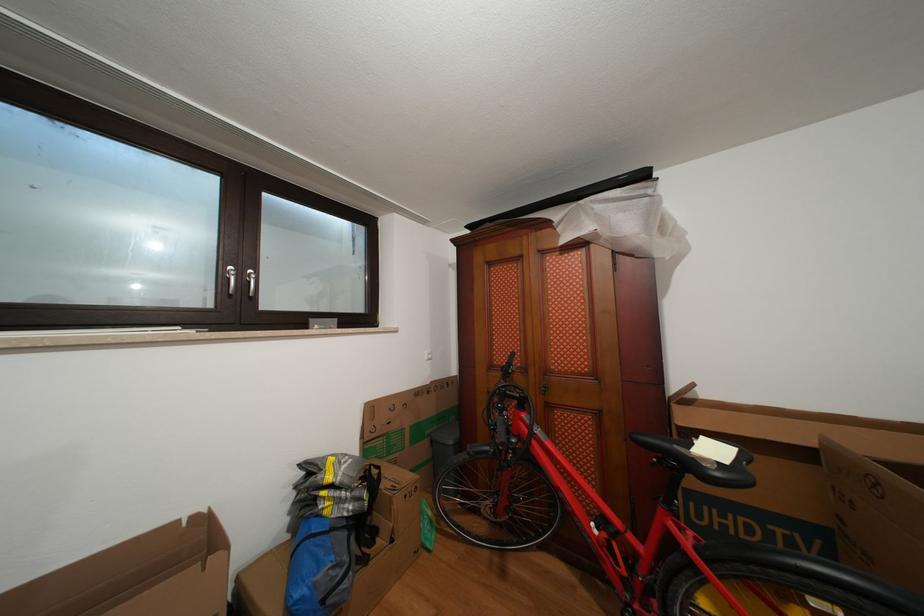
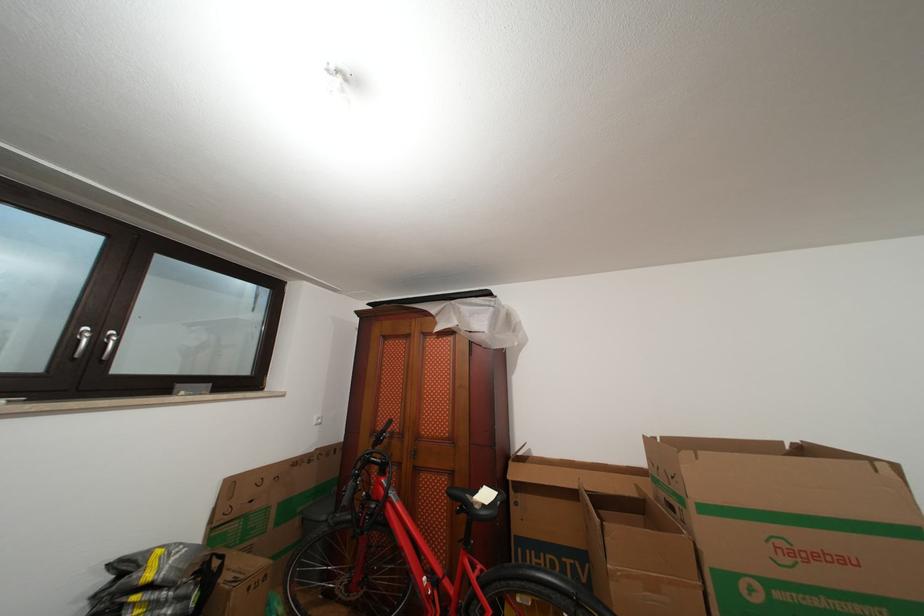
Question: The images are taken continuously from a first-person perspective. In which direction is your viewpoint rotating?

Choices:
 (A) Left
 (B) Right
 (C) Up
 (D) Down

Answer: (B)